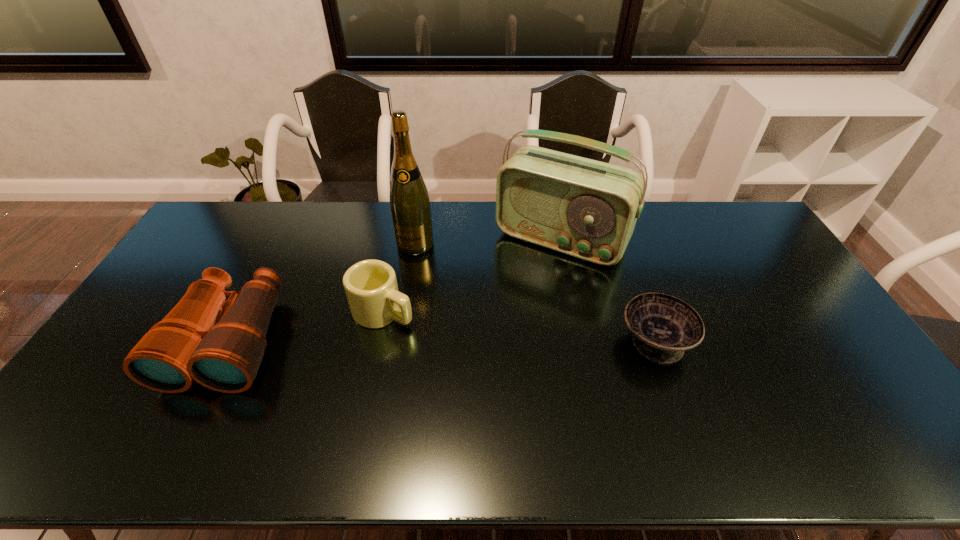
Find the location of a particular element. The width and height of the screenshot is (960, 540). free space on the desktop that is between the leftmost object and the shortest object and is positioned on the front-facing side of the tallest object is located at coordinates (383, 341).

I want to click on vacant spot on the desktop that is between the leftmost object and the bowl and is positioned on the front panel of the fourth shortest object, so (x=498, y=341).

Find the location of a particular element. This screenshot has width=960, height=540. free spot on the desktop that is between the leftmost object and the bowl and is positioned with the handle on the side of the mug is located at coordinates (440, 341).